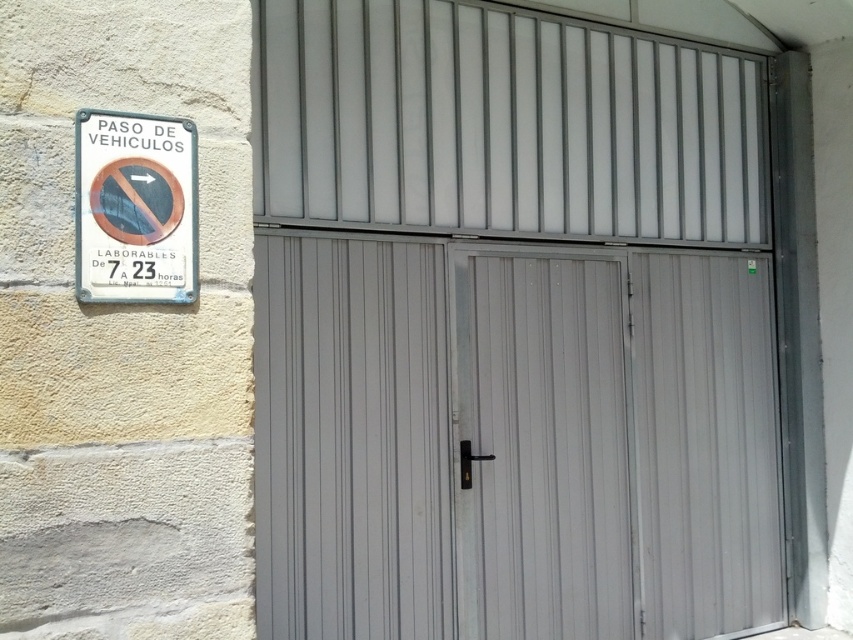
You are standing in front of the building and notice two points marked on the wall. Which point, point (x=339, y=257) or point (x=561, y=525), is closer to you?

Point (x=339, y=257) is closer to the camera than point (x=561, y=525), so it is closer to you.